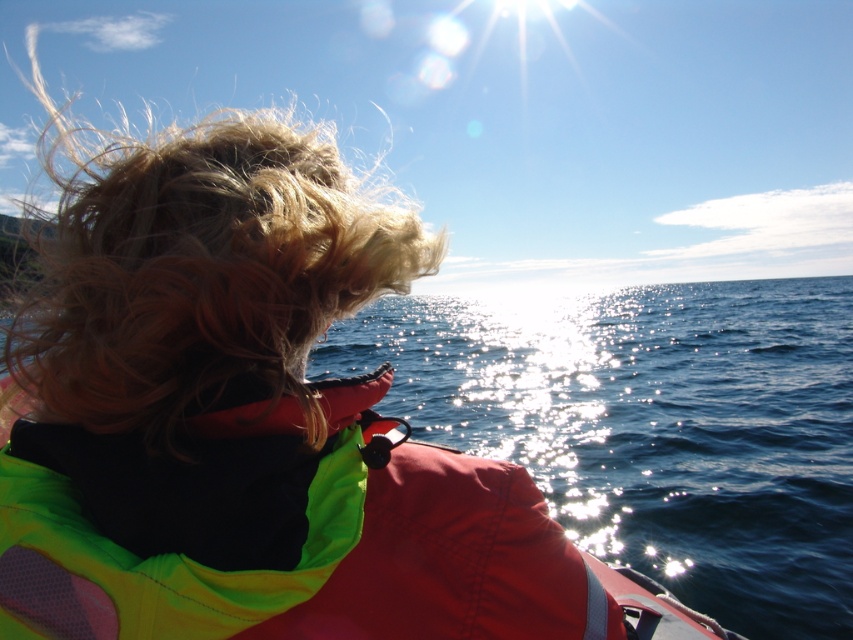
Question: Which of these objects is positioned closest to the blonde hair at upper left?

Choices:
 (A) glistening blue water at center
 (B) neon green/yellow fabric life jacket at upper left

Answer: (B)

Question: Can you confirm if blonde hair at upper left is positioned below neon green/yellow fabric life jacket at upper left?

Choices:
 (A) no
 (B) yes

Answer: (A)

Question: In this image, where is blonde hair at upper left located relative to neon green/yellow fabric life jacket at upper left?

Choices:
 (A) above
 (B) below

Answer: (A)

Question: Can you confirm if blonde hair at upper left is positioned above neon green/yellow fabric life jacket at upper left?

Choices:
 (A) no
 (B) yes

Answer: (B)

Question: Among these points, which one is nearest to the camera?

Choices:
 (A) (143, 538)
 (B) (131, 141)
 (C) (816, 392)

Answer: (A)

Question: Among these objects, which one is nearest to the camera?

Choices:
 (A) neon green/yellow fabric life jacket at upper left
 (B) blonde hair at upper left
 (C) glistening blue water at center

Answer: (A)